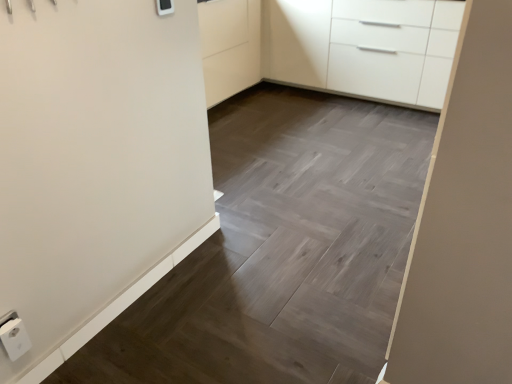
Question: Based on their sizes in the image, would you say white glossy cabinet at upper right is bigger or smaller than white plastic electric outlet at lower left?

Choices:
 (A) small
 (B) big

Answer: (B)

Question: Is white glossy cabinet at upper right situated inside white plastic electric outlet at lower left or outside?

Choices:
 (A) outside
 (B) inside

Answer: (A)

Question: Estimate the real-world distances between objects in this image. Which object is closer to the white glossy cabinet at upper right?

Choices:
 (A) white plastic electric outlet at lower left
 (B) white plastic light switch at upper center

Answer: (B)

Question: Which is farther from the white plastic light switch at upper center?

Choices:
 (A) white glossy cabinet at upper right
 (B) white plastic electric outlet at lower left

Answer: (A)